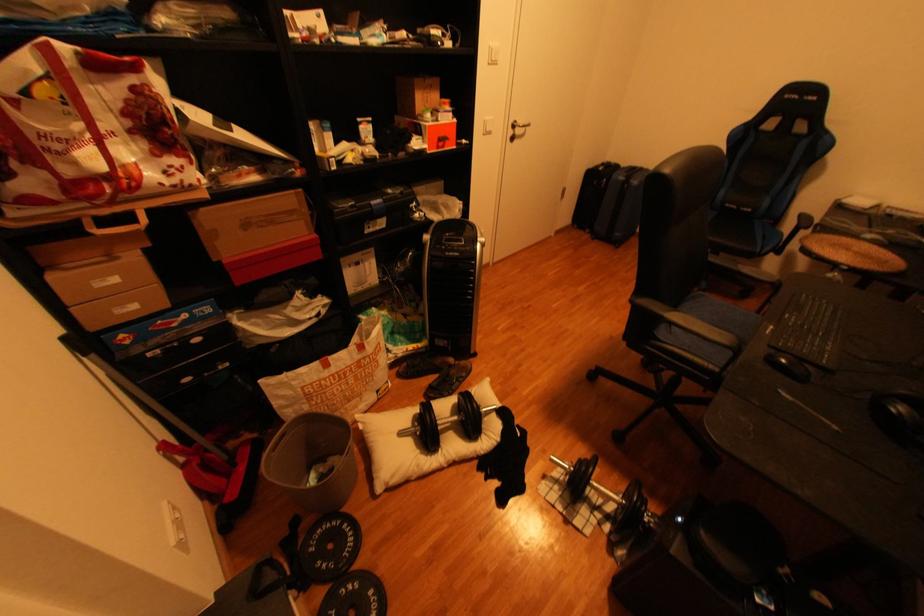
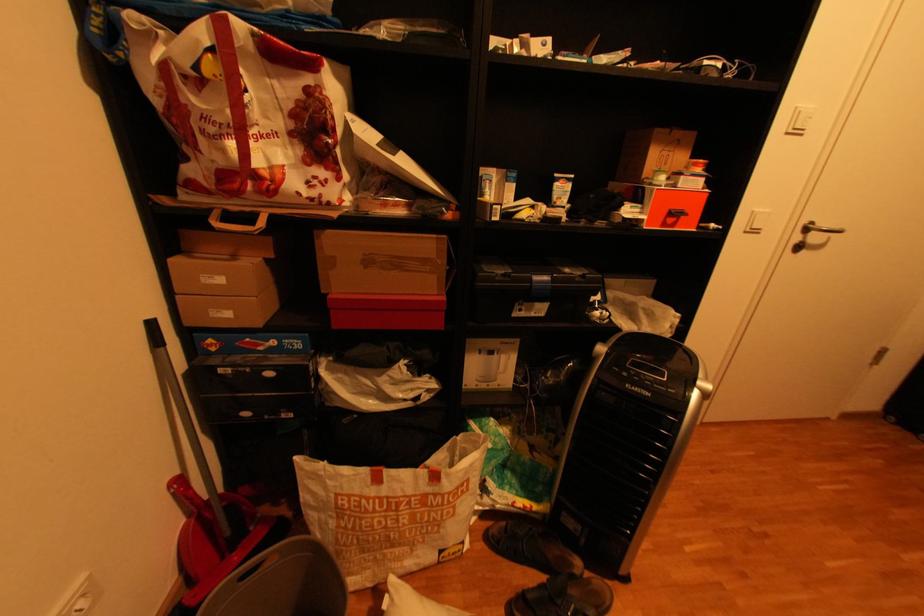
Question: The first image is from the beginning of the video and the second image is from the end. How did the camera likely rotate when shooting the video?

Choices:
 (A) Left
 (B) Right
 (C) Up
 (D) Down

Answer: (A)